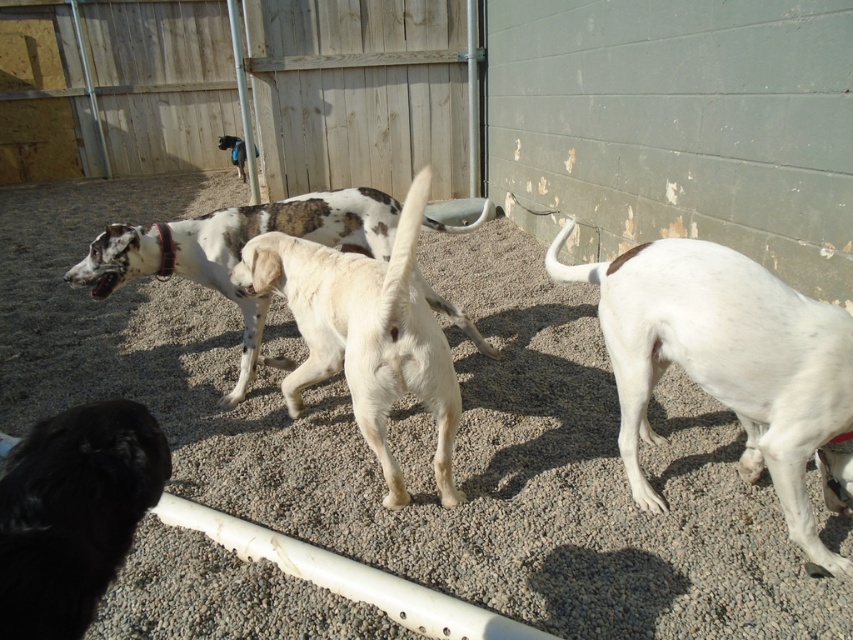
Question: Which point is closer to the camera taking this photo?

Choices:
 (A) (485, 212)
 (B) (361, 45)
 (C) (453, 502)
 (D) (242, 157)

Answer: (C)

Question: In this image, where is white smooth dog at right located relative to black fluffy dog at lower left?

Choices:
 (A) left
 (B) right

Answer: (B)

Question: Which object is closer to the camera taking this photo?

Choices:
 (A) black leather collar at upper center
 (B) white fur dog at center
 (C) white smooth dog at right
 (D) spotted fur dog at center

Answer: (C)

Question: Can you confirm if white fur dog at center is positioned to the left of black fluffy dog at lower left?

Choices:
 (A) no
 (B) yes

Answer: (A)

Question: Does white smooth dog at right have a smaller size compared to black leather collar at upper center?

Choices:
 (A) no
 (B) yes

Answer: (A)

Question: Estimate the real-world distances between objects in this image. Which object is farther from the spotted fur dog at center?

Choices:
 (A) gray gravel at center
 (B) black leather collar at upper center
 (C) white smooth dog at right

Answer: (B)